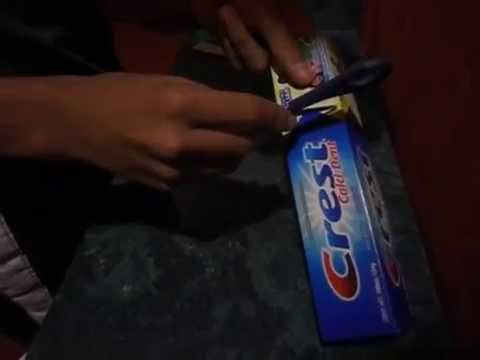
Where is `white section of blanket bottom left`? This screenshot has height=360, width=480. white section of blanket bottom left is located at coordinates (16, 282).